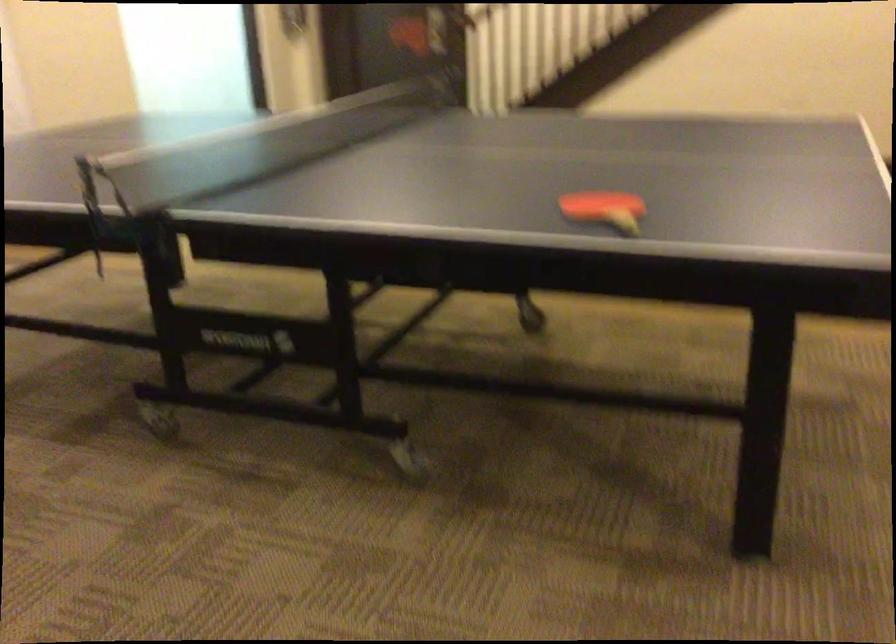
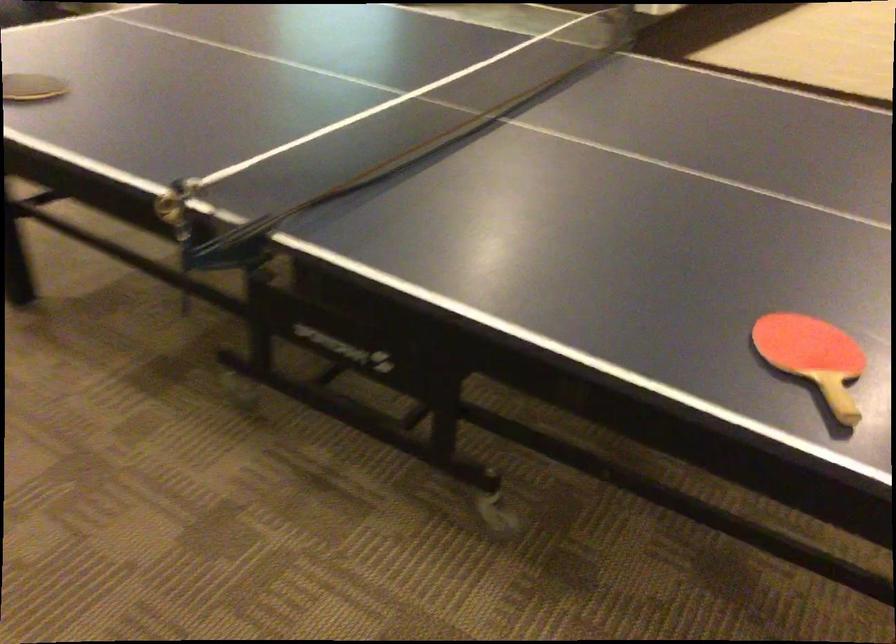
Question: The first image is from the beginning of the video and the second image is from the end. How did the camera likely rotate when shooting the video?

Choices:
 (A) Left
 (B) Right
 (C) Up
 (D) Down

Answer: (D)